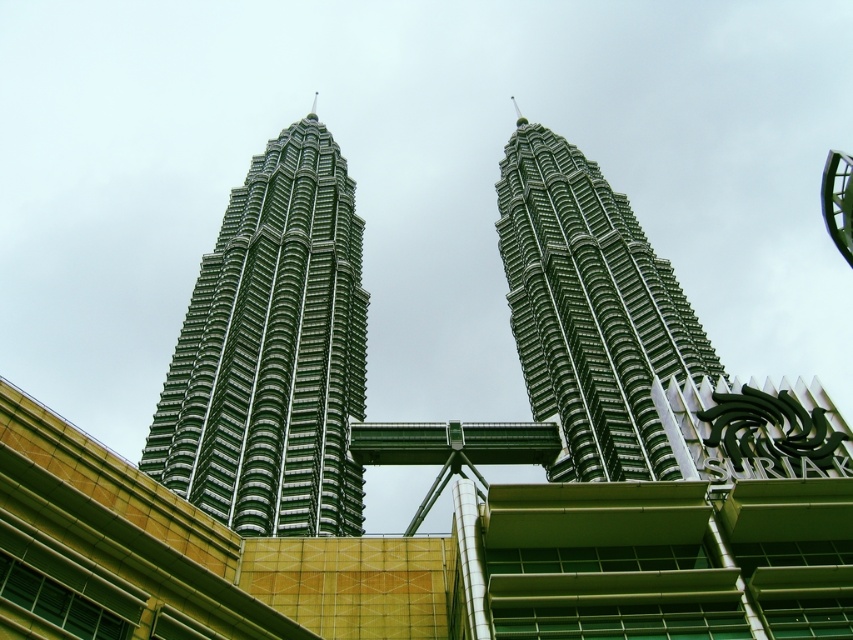
Question: Is green glassy skyscraper at center further to the viewer compared to green metallic twin towers at center?

Choices:
 (A) no
 (B) yes

Answer: (A)

Question: Which object is closer to the camera taking this photo?

Choices:
 (A) green metallic twin towers at center
 (B) green glassy skyscraper at center

Answer: (B)

Question: Can you confirm if green glassy skyscraper at center is bigger than green metallic twin towers at center?

Choices:
 (A) no
 (B) yes

Answer: (A)

Question: Can you confirm if green glassy skyscraper at center is positioned to the right of green metallic twin towers at center?

Choices:
 (A) yes
 (B) no

Answer: (B)

Question: Which object appears farthest from the camera in this image?

Choices:
 (A) green glassy skyscraper at center
 (B) green metallic twin towers at center

Answer: (B)